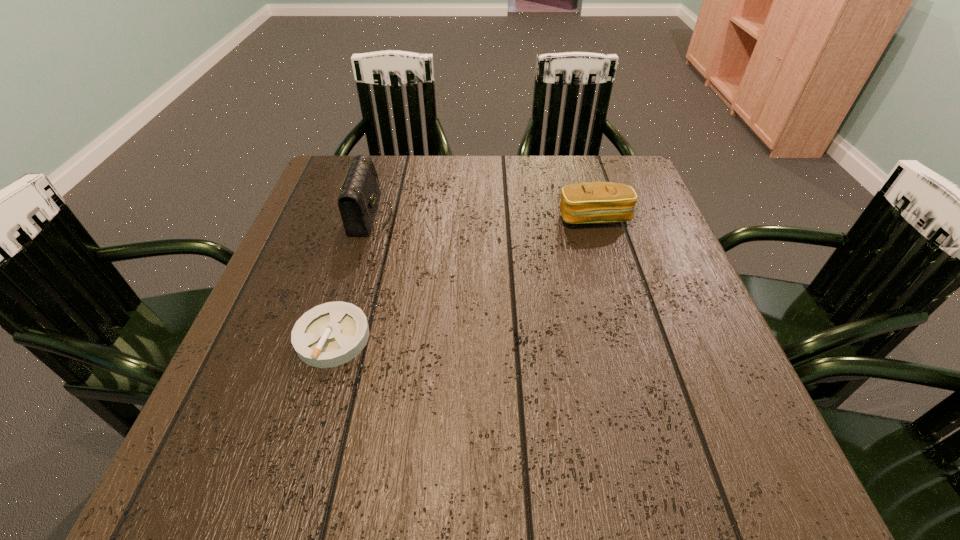
This screenshot has height=540, width=960. In order to click on vacant space that's between the taller clutch bag and the ashtray in this screenshot , I will do `click(351, 276)`.

Select which object appears as the second closest to the shorter clutch bag. Please provide its 2D coordinates. Your answer should be formatted as a tuple, i.e. [(x, y)], where the tuple contains the x and y coordinates of a point satisfying the conditions above.

[(331, 334)]

This screenshot has width=960, height=540. I want to click on object identified as the second closest to the left clutch bag, so click(591, 202).